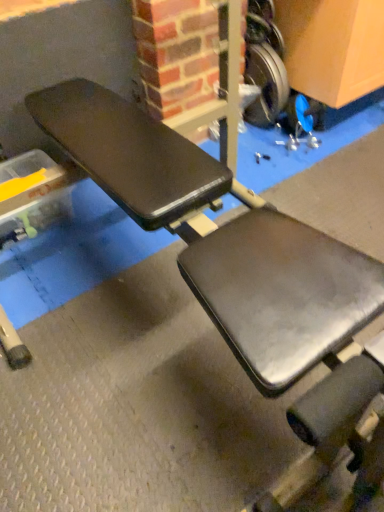
This screenshot has width=384, height=512. Describe the element at coordinates (265, 85) in the screenshot. I see `silver metallic weight at upper right, the 1th wheel from the bottom` at that location.

This screenshot has width=384, height=512. What are the coordinates of `silver metallic weight at upper right, the 1th wheel from the bottom` in the screenshot? It's located at (265, 85).

Measure the distance between point (275,117) and camera.

Point (275,117) is 1.90 meters away from camera.

What is the approximate width of metallic silver wheel at upper right, the first wheel from the top?

metallic silver wheel at upper right, the first wheel from the top, is 10.28 inches wide.

Locate an element on the screen. Image resolution: width=384 pixels, height=512 pixels. metallic silver wheel at upper right, the first wheel from the top is located at coordinates (263, 31).

The height and width of the screenshot is (512, 384). What do you see at coordinates (263, 31) in the screenshot? I see `metallic silver wheel at upper right, the first wheel from the top` at bounding box center [263, 31].

Identify the location of silver metallic weight at upper right, the 1th wheel from the bottom. The width and height of the screenshot is (384, 512). (265, 85).

Which is more to the left, silver metallic weight at upper right, the 1th wheel from the bottom, or metallic silver wheel at upper right, the 2th wheel ordered from the bottom?

metallic silver wheel at upper right, the 2th wheel ordered from the bottom.

Considering their positions, is silver metallic weight at upper right, the 1th wheel from the bottom, located in front of or behind metallic silver wheel at upper right, the first wheel from the top?

Visually, silver metallic weight at upper right, the 1th wheel from the bottom, is located behind metallic silver wheel at upper right, the first wheel from the top.

Based on the photo, which point is more distant from viewer, (282,85) or (247,23)?

The point (247,23) is more distant.

From the image's perspective, between silver metallic weight at upper right, which is counted as the second wheel, starting from the top, and metallic silver wheel at upper right, the first wheel from the top, which one is located above?

metallic silver wheel at upper right, the first wheel from the top, appears higher in the image.

From a real-world perspective, is silver metallic weight at upper right, the 1th wheel from the bottom, physically located above or below metallic silver wheel at upper right, the first wheel from the top?

From a real-world perspective, silver metallic weight at upper right, the 1th wheel from the bottom, is physically below metallic silver wheel at upper right, the first wheel from the top.

Can you confirm if silver metallic weight at upper right, which is counted as the second wheel, starting from the top, is wider than metallic silver wheel at upper right, the first wheel from the top?

In fact, silver metallic weight at upper right, which is counted as the second wheel, starting from the top, might be narrower than metallic silver wheel at upper right, the first wheel from the top.

Who is shorter, silver metallic weight at upper right, the 1th wheel from the bottom, or metallic silver wheel at upper right, the 2th wheel ordered from the bottom?

metallic silver wheel at upper right, the 2th wheel ordered from the bottom.

Looking at the image, does silver metallic weight at upper right, the 1th wheel from the bottom, seem bigger or smaller compared to metallic silver wheel at upper right, the 2th wheel ordered from the bottom?

In the image, silver metallic weight at upper right, the 1th wheel from the bottom, appears to be larger than metallic silver wheel at upper right, the 2th wheel ordered from the bottom.

Would you say metallic silver wheel at upper right, the 2th wheel ordered from the bottom, is part of silver metallic weight at upper right, which is counted as the second wheel, starting from the top,'s contents?

Actually, metallic silver wheel at upper right, the 2th wheel ordered from the bottom, is outside silver metallic weight at upper right, which is counted as the second wheel, starting from the top.

Is silver metallic weight at upper right, which is counted as the second wheel, starting from the top, looking in the opposite direction of metallic silver wheel at upper right, the first wheel from the top?

No, silver metallic weight at upper right, which is counted as the second wheel, starting from the top, is not facing away from metallic silver wheel at upper right, the first wheel from the top.

What's the angular difference between silver metallic weight at upper right, the 1th wheel from the bottom, and metallic silver wheel at upper right, the first wheel from the top,'s facing directions?

They differ by 0.526 degrees in their facing directions.

The height and width of the screenshot is (512, 384). I want to click on wheel located behind the metallic silver wheel at upper right, the first wheel from the top, so 265,85.

Which object is positioned more to the left, metallic silver wheel at upper right, the first wheel from the top, or silver metallic weight at upper right, which is counted as the second wheel, starting from the top?

Positioned to the left is metallic silver wheel at upper right, the first wheel from the top.

Which object is more forward, metallic silver wheel at upper right, the first wheel from the top, or silver metallic weight at upper right, the 1th wheel from the bottom?

metallic silver wheel at upper right, the first wheel from the top.

Which is further, (248, 17) or (283, 95)?

The point (283, 95) is farther.

From the image's perspective, does metallic silver wheel at upper right, the first wheel from the top, appear lower than silver metallic weight at upper right, which is counted as the second wheel, starting from the top?

No, from the image's perspective, metallic silver wheel at upper right, the first wheel from the top, is not below silver metallic weight at upper right, which is counted as the second wheel, starting from the top.

From a real-world perspective, which object stands above the other?

In real-world perspective, metallic silver wheel at upper right, the first wheel from the top, is above.

Which object is wider, metallic silver wheel at upper right, the first wheel from the top, or silver metallic weight at upper right, the 1th wheel from the bottom?

Wider between the two is metallic silver wheel at upper right, the first wheel from the top.

Does metallic silver wheel at upper right, the 2th wheel ordered from the bottom, have a greater height compared to silver metallic weight at upper right, the 1th wheel from the bottom?

No.

In terms of size, does metallic silver wheel at upper right, the 2th wheel ordered from the bottom, appear bigger or smaller than silver metallic weight at upper right, which is counted as the second wheel, starting from the top?

metallic silver wheel at upper right, the 2th wheel ordered from the bottom, is smaller than silver metallic weight at upper right, which is counted as the second wheel, starting from the top.

Would you say metallic silver wheel at upper right, the first wheel from the top, contains silver metallic weight at upper right, which is counted as the second wheel, starting from the top?

No.

Are metallic silver wheel at upper right, the 2th wheel ordered from the bottom, and silver metallic weight at upper right, which is counted as the second wheel, starting from the top, beside each other?

No, metallic silver wheel at upper right, the 2th wheel ordered from the bottom, is not beside silver metallic weight at upper right, which is counted as the second wheel, starting from the top.

Is silver metallic weight at upper right, the 1th wheel from the bottom, at the back of metallic silver wheel at upper right, the first wheel from the top?

No, metallic silver wheel at upper right, the first wheel from the top, is not facing the opposite direction of silver metallic weight at upper right, the 1th wheel from the bottom.

How different are the orientations of metallic silver wheel at upper right, the 2th wheel ordered from the bottom, and silver metallic weight at upper right, the 1th wheel from the bottom, in degrees?

The angle between the facing direction of metallic silver wheel at upper right, the 2th wheel ordered from the bottom, and the facing direction of silver metallic weight at upper right, the 1th wheel from the bottom, is 0.526 degrees.

Identify the location of wheel below the metallic silver wheel at upper right, the first wheel from the top (from the image's perspective). This screenshot has width=384, height=512. (265, 85).

What are the coordinates of `wheel lying in front of the silver metallic weight at upper right, the 1th wheel from the bottom` in the screenshot? It's located at (263, 31).

Identify the location of wheel below the metallic silver wheel at upper right, the 2th wheel ordered from the bottom (from the image's perspective). (265, 85).